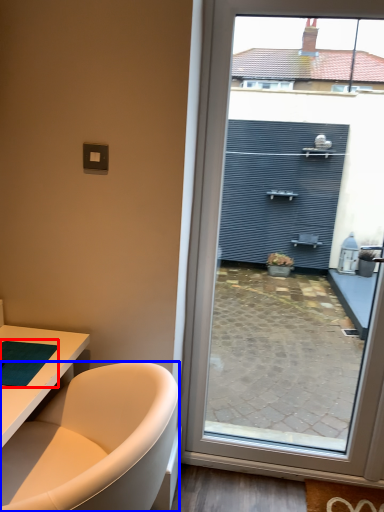
Question: Which of the following is the farthest to the observer, yoga mat (highlighted by a red box) or bathtub (highlighted by a blue box)?

Choices:
 (A) yoga mat
 (B) bathtub

Answer: (A)